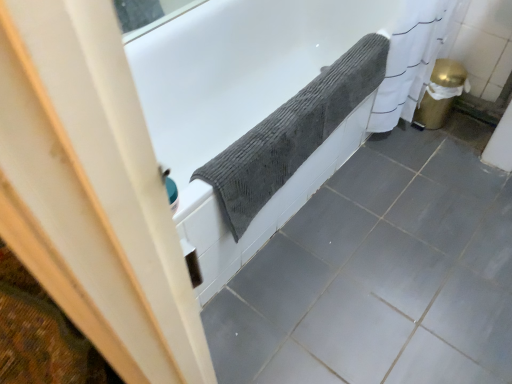
Locate an element on the screen. free spot above gray matte ceramic tile at lower center, positioned as the 1th ceramic tile in top-to-bottom order (from a real-world perspective) is located at coordinates (497, 216).